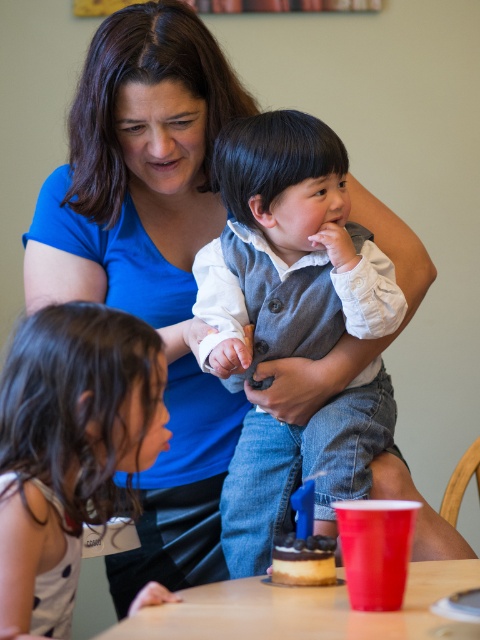
Question: Does matte gray vest at center come in front of wooden table at lower center?

Choices:
 (A) yes
 (B) no

Answer: (B)

Question: Which point is farther to the camera?

Choices:
 (A) matte gray vest at center
 (B) wooden table at lower center
 (C) white dotted dress at lower left

Answer: (A)

Question: Does white dotted dress at lower left appear under wooden table at lower center?

Choices:
 (A) yes
 (B) no

Answer: (B)

Question: Which of the following is the farthest from the observer?

Choices:
 (A) white dotted dress at lower left
 (B) matte gray vest at center
 (C) wooden table at lower center

Answer: (B)

Question: Which object is the farthest from the matte gray vest at center?

Choices:
 (A) wooden table at lower center
 (B) white dotted dress at lower left

Answer: (A)

Question: Can you confirm if white dotted dress at lower left is smaller than wooden table at lower center?

Choices:
 (A) no
 (B) yes

Answer: (A)